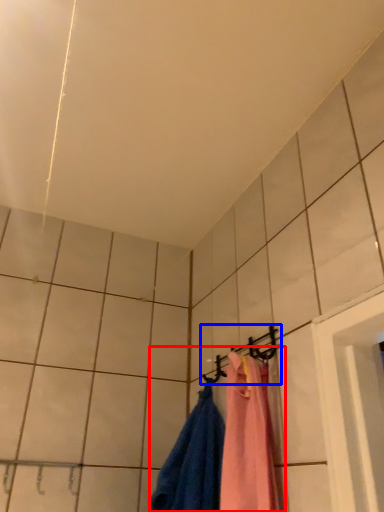
Question: Which of the following is the farthest to the observer, laundry (highlighted by a red box) or hanger (highlighted by a blue box)?

Choices:
 (A) laundry
 (B) hanger

Answer: (B)